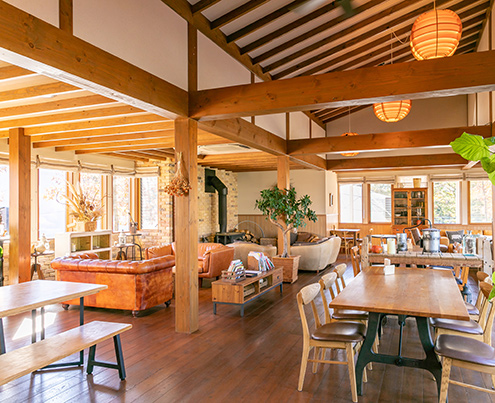
Find the location of a particular element. hardwood floor is located at coordinates [241, 361].